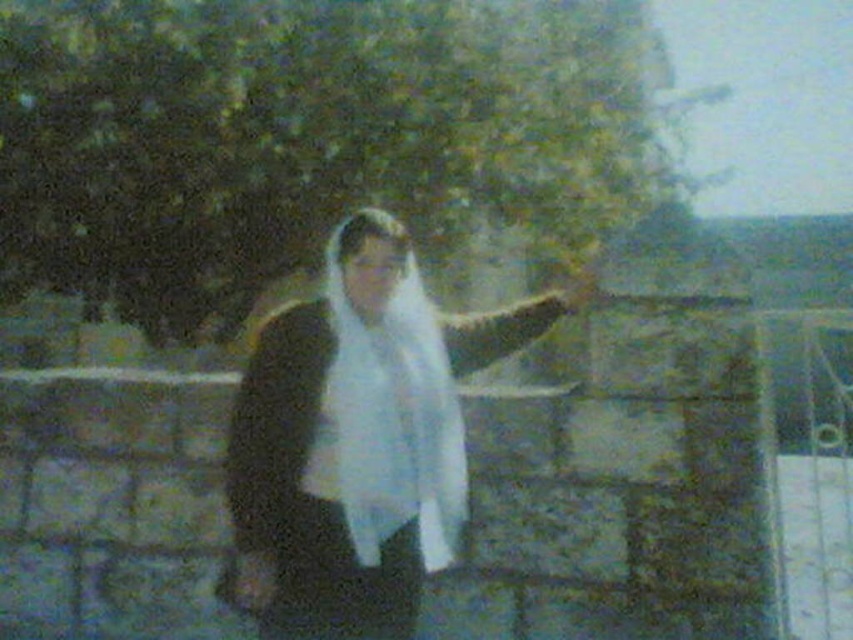
You are a photographer trying to capture the person in the scene. You notice the white matte scarf at center and the white soft fabric veil at center. Which object should you focus on first to ensure both are in sharp focus?

You should focus on the white matte scarf at center first because it is closer to the viewer than the white soft fabric veil at center. By focusing on the closer object, the veil will fall within the depth of field and remain sharp.

You are a fashion designer analyzing the image of a person wearing traditional attire. The person has a white matte scarf at center and a white soft fabric veil at center. Which of these two items is taller?

The white matte scarf at center is much taller than the white soft fabric veil at center.

You are a photographer trying to capture the exact position of the white matte scarf at center in the image. According to the coordinates provided, where would you focus your camera lens to ensure the scarf is centered in the frame?

The white matte scarf at center is located at coordinates point (358, 440), so you should focus your camera lens on that point to center the scarf in the frame.